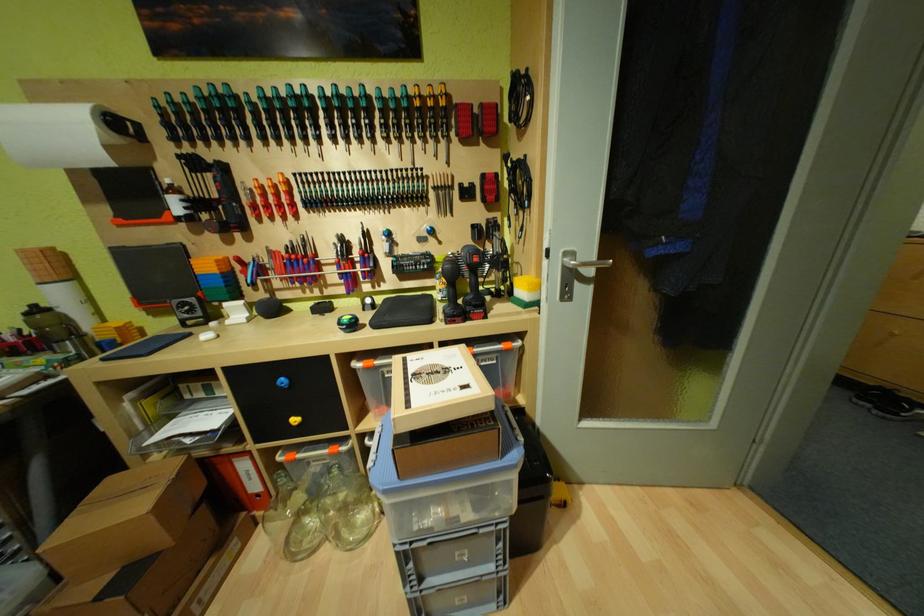
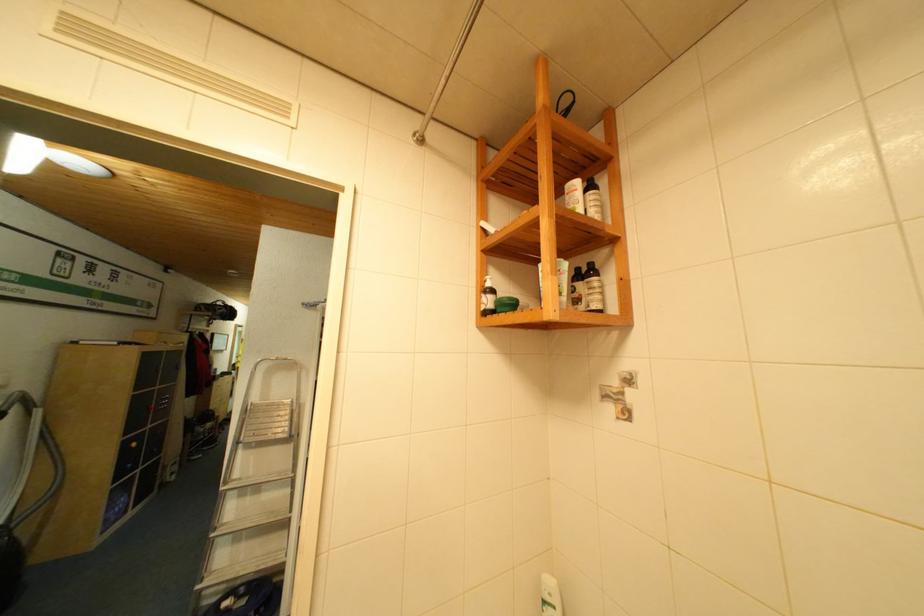
Question: I am providing you with two images of the same scene from different viewpoints. Which of the following objects are not visible in image2?

Choices:
 (A) white cosmetic bottle
 (B) red button
 (C) cordless drill handle
 (D) metal wall fixture

Answer: (C)